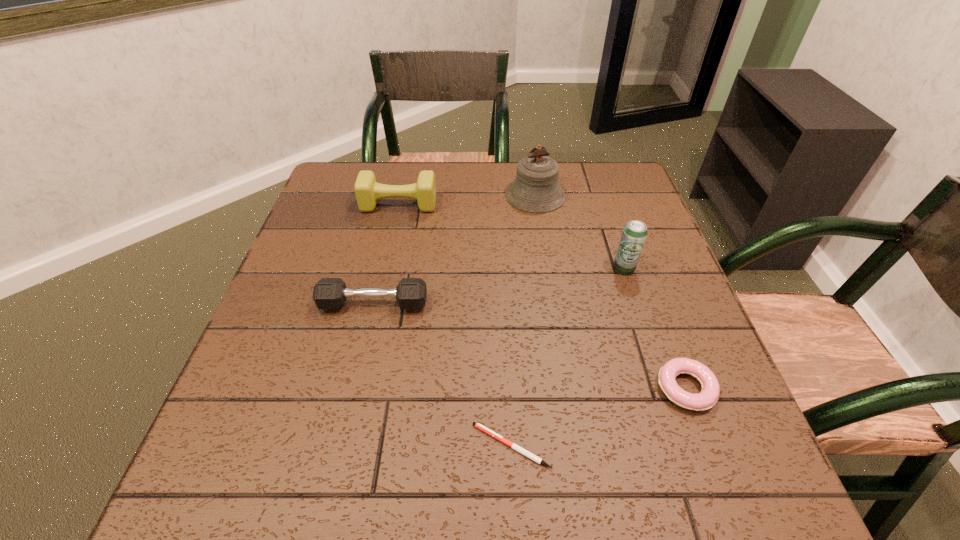
Image resolution: width=960 pixels, height=540 pixels. I want to click on the shortest object, so click(x=521, y=450).

Find the location of a particular element. The height and width of the screenshot is (540, 960). blank space located on the left of the bell is located at coordinates (481, 195).

Image resolution: width=960 pixels, height=540 pixels. Identify the location of blank area located on the left of the fourth nearest object. (445, 268).

The width and height of the screenshot is (960, 540). Identify the location of free space located 0.150m on the right of the third tallest object. (490, 205).

The width and height of the screenshot is (960, 540). What are the coordinates of `vacant area situated on the back of the third shortest object` in the screenshot? It's located at (396, 206).

Identify the location of blank space located 0.350m on the back of the fifth tallest object. The height and width of the screenshot is (540, 960). (633, 246).

This screenshot has height=540, width=960. I want to click on vacant region located 0.060m on the clicker of the nearest object, so click(x=437, y=446).

Identify the location of free space located on the clicker of the nearest object. (354, 446).

Identify the location of vacant position located 0.120m on the clicker of the nearest object. The image size is (960, 540). (401, 446).

This screenshot has height=540, width=960. I want to click on bell that is positioned at the far edge, so click(536, 189).